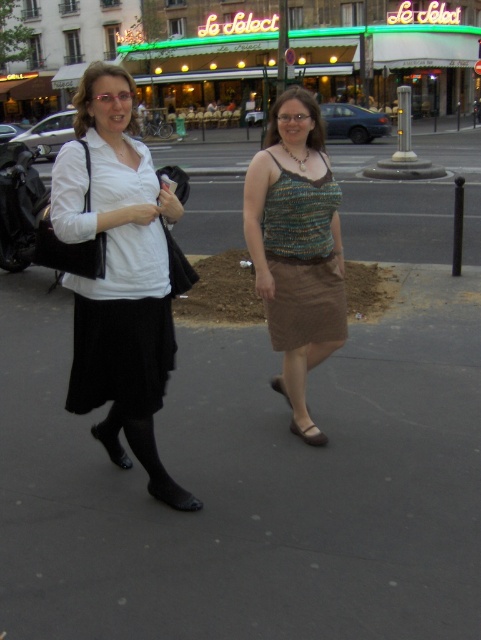
Which is above, matte black skirt at left or knitted fabric dress at center?

matte black skirt at left is above.

Is matte black skirt at left wider than knitted fabric dress at center?

No, matte black skirt at left is not wider than knitted fabric dress at center.

Locate an element on the screen. The image size is (481, 640). matte black skirt at left is located at coordinates (118, 275).

Locate an element on the screen. This screenshot has height=640, width=481. matte black skirt at left is located at coordinates (118, 275).

Does knitted fabric tank top at center lie in front of knitted fabric dress at center?

That is True.

Where is `knitted fabric tank top at center`? knitted fabric tank top at center is located at coordinates (296, 248).

Describe the element at coordinates (296, 248) in the screenshot. I see `knitted fabric tank top at center` at that location.

The height and width of the screenshot is (640, 481). Identify the location of knitted fabric tank top at center. (296, 248).

The image size is (481, 640). What do you see at coordinates (118, 275) in the screenshot?
I see `matte black skirt at left` at bounding box center [118, 275].

Is point (165, 202) closer to viewer compared to point (332, 260)?

Yes, it is in front of point (332, 260).

Who is more forward, (64, 186) or (303, 304)?

Point (64, 186) is more forward.

At what (x,y) coordinates should I click in order to perform the action: click on matte black skirt at left. Please return your answer as a coordinate pair (x, y). Looking at the image, I should click on (118, 275).